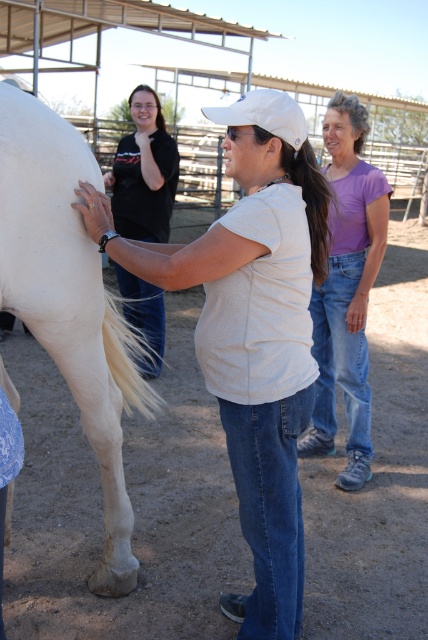
Who is positioned more to the right, white matte horse at left or purple cotton shirt at center?

purple cotton shirt at center is more to the right.

Where is `white matte horse at left`? This screenshot has width=428, height=640. white matte horse at left is located at coordinates (70, 301).

Who is lower down, white matte shirt at center or white matte horse at left?

white matte shirt at center

Between white matte shirt at center and white matte horse at left, which one has more height?

Standing taller between the two is white matte horse at left.

You are a GUI agent. You are given a task and a screenshot of the screen. Output one action in this format:
    pyautogui.click(x=<x>, y=<y>)
    Task: Click on the white matte shirt at center
    The width and height of the screenshot is (428, 640).
    Given the screenshot: What is the action you would take?
    pyautogui.click(x=252, y=332)

Does point (241, 280) come behind point (137, 282)?

No, it is in front of (137, 282).

You are a GUI agent. You are given a task and a screenshot of the screen. Output one action in this format:
    pyautogui.click(x=<x>, y=<y>)
    Task: Click on the white matte shirt at center
    
    Given the screenshot: What is the action you would take?
    pyautogui.click(x=252, y=332)